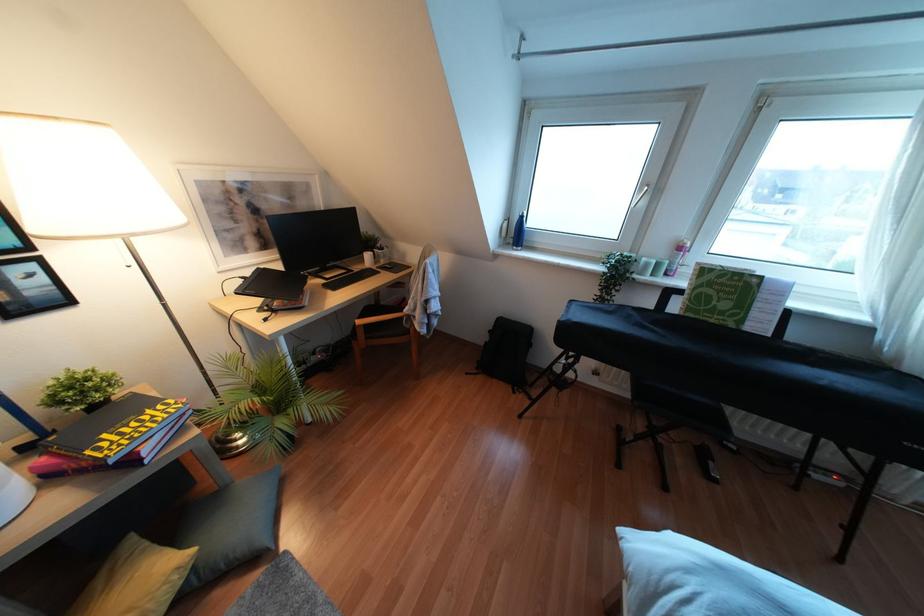
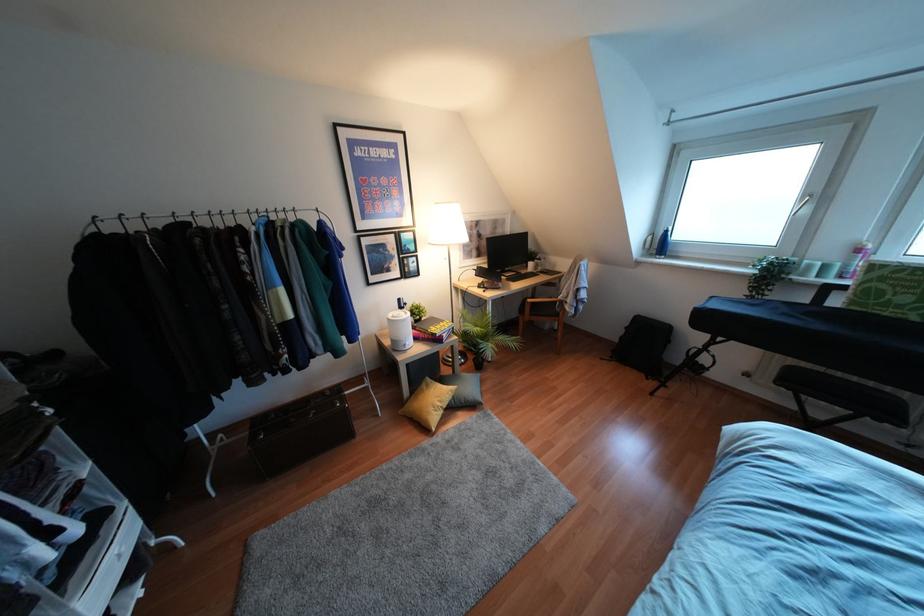
Locate, in the second image, the point that corresponds to point 679,246 in the first image.

(858, 249)